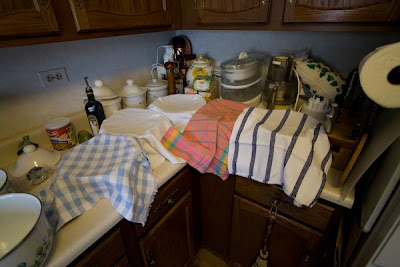
You are a GUI agent. You are given a task and a screenshot of the screen. Output one action in this format:
    pyautogui.click(x=<x>, y=<y>)
    Task: Click on the electrical outlet
    The width and height of the screenshot is (400, 267).
    Given the screenshot: What is the action you would take?
    pyautogui.click(x=53, y=74)